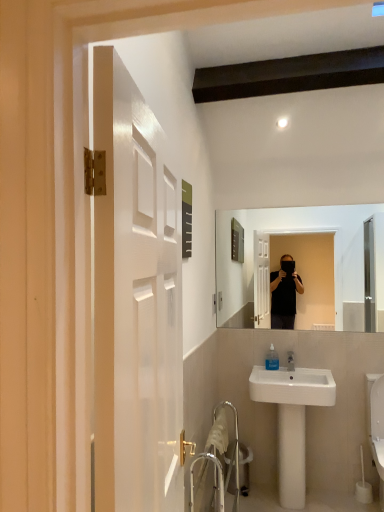
Question: Considering their positions, is white ceramic sink at lower right located in front of or behind white glossy toilet at lower right?

Choices:
 (A) behind
 (B) front

Answer: (A)

Question: From the image's perspective, relative to white glossy toilet at lower right, is white ceramic sink at lower right above or below?

Choices:
 (A) below
 (B) above

Answer: (B)

Question: Estimate the real-world distances between objects in this image. Which object is farther from the metallic silver trash can at lower center?

Choices:
 (A) white glossy toilet at lower right
 (B) white ceramic sink at lower right

Answer: (A)

Question: Which of these objects is positioned farthest from the metallic silver trash can at lower center?

Choices:
 (A) white ceramic sink at lower right
 (B) white glossy toilet at lower right

Answer: (B)